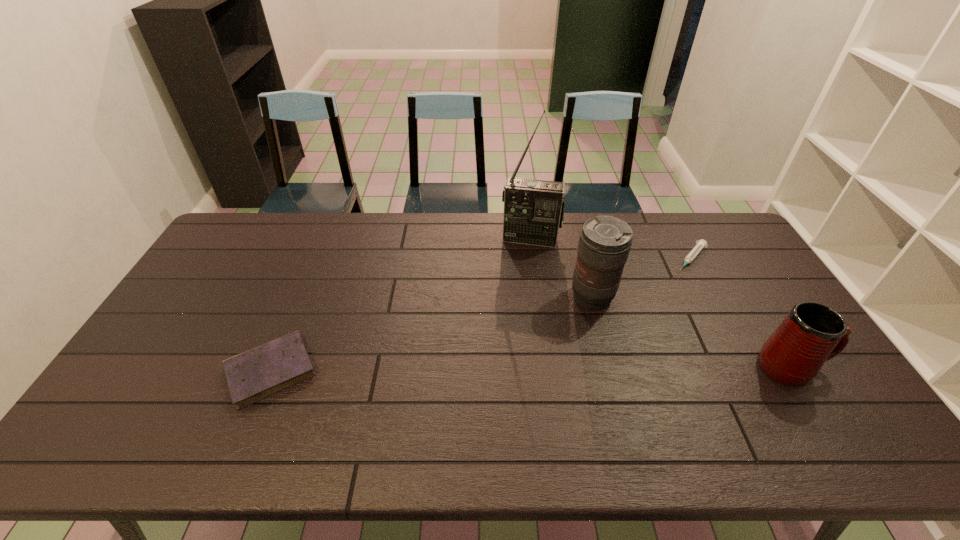
You are a GUI agent. You are given a task and a screenshot of the screen. Output one action in this format:
    pyautogui.click(x=<x>, y=<y>)
    Task: Click on the vacant region located 0.160m at the needle end of the syringe
    The image size is (960, 540).
    Given the screenshot: What is the action you would take?
    pyautogui.click(x=662, y=295)

Find the location of a particular element. The image size is (960, 540). vacant space located at the needle end of the syringe is located at coordinates (638, 324).

Image resolution: width=960 pixels, height=540 pixels. What are the coordinates of `vacant space located 0.260m at the needle end of the syringe` in the screenshot? It's located at (648, 313).

The image size is (960, 540). Find the location of `blank area located on the display of the radio receiver`. blank area located on the display of the radio receiver is located at coordinates (523, 266).

Locate an element on the screen. The width and height of the screenshot is (960, 540). free space located 0.100m on the display of the radio receiver is located at coordinates (523, 266).

Image resolution: width=960 pixels, height=540 pixels. Find the location of `vacant space situated 0.110m on the display of the radio receiver`. vacant space situated 0.110m on the display of the radio receiver is located at coordinates (523, 268).

The height and width of the screenshot is (540, 960). I want to click on syringe that is at the far edge, so click(x=700, y=244).

This screenshot has width=960, height=540. I want to click on radio receiver present at the far edge, so click(x=533, y=209).

At what (x,y) coordinates should I click in order to perform the action: click on diary at the near edge. Please return your answer as a coordinate pair (x, y). The image size is (960, 540). Looking at the image, I should click on (258, 373).

The image size is (960, 540). Find the location of `mug located at the near edge`. mug located at the near edge is located at coordinates (812, 333).